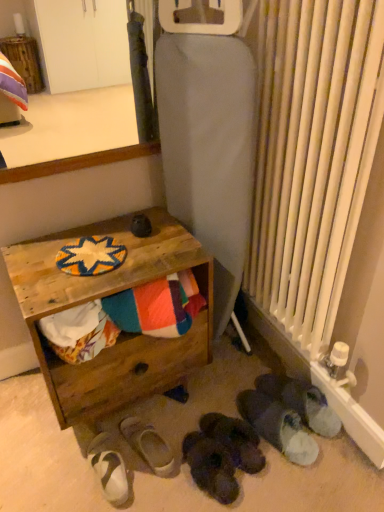
Find the location of a particular element. The image size is (384, 512). vacant space behind dark gray fabric slippers at lower right, the first footwear in the right-to-left sequence is located at coordinates (253, 360).